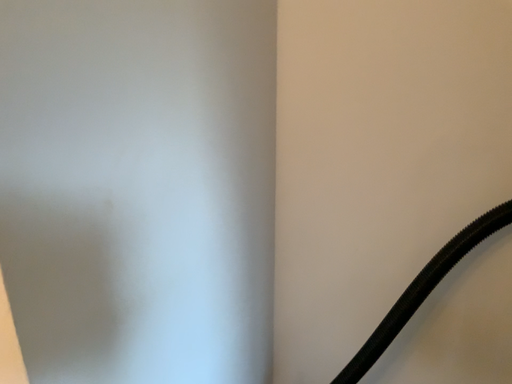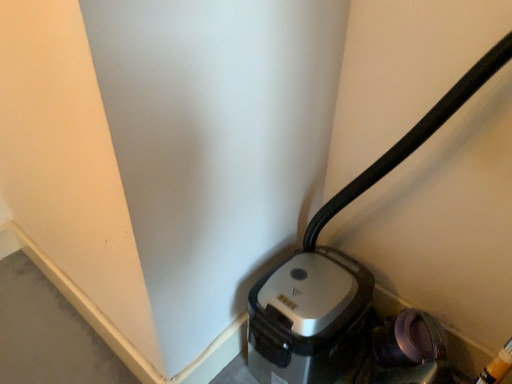
Question: Which way did the camera rotate in the video?

Choices:
 (A) rotated right
 (B) rotated left

Answer: (B)